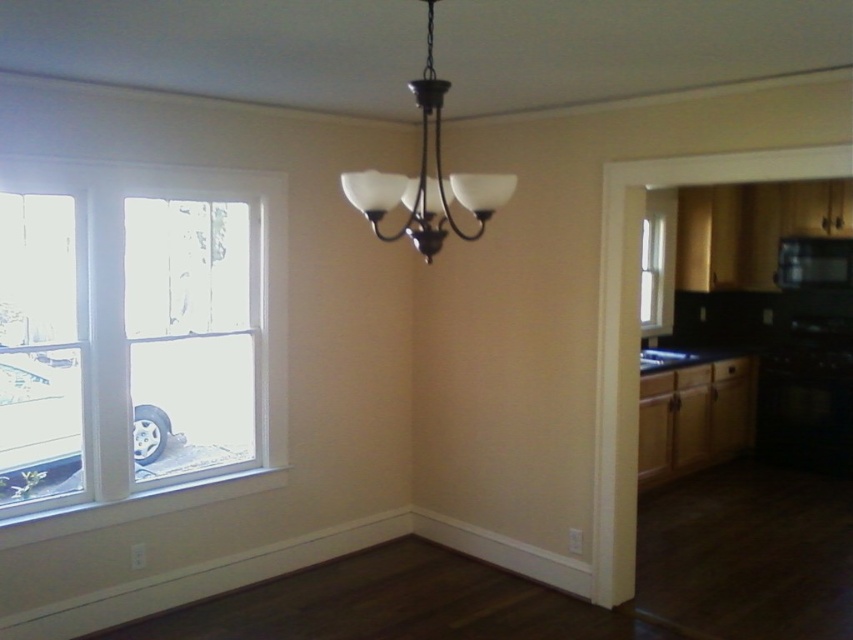
Question: Which of the following is the closest to the observer?

Choices:
 (A) (410, 220)
 (B) (653, 288)
 (C) (833, 260)
 (D) (207, 298)

Answer: (D)

Question: Can you confirm if matte black chandelier at upper center is smaller than black matte microwave at upper right?

Choices:
 (A) no
 (B) yes

Answer: (A)

Question: Can you confirm if matte black chandelier at upper center is positioned to the left of black matte microwave at upper right?

Choices:
 (A) yes
 (B) no

Answer: (A)

Question: Is white glass window at left smaller than matte black chandelier at upper center?

Choices:
 (A) yes
 (B) no

Answer: (B)

Question: Among these points, which one is nearest to the camera?

Choices:
 (A) (646, 288)
 (B) (467, 188)
 (C) (787, 257)

Answer: (B)

Question: Estimate the real-world distances between objects in this image. Which object is closer to the black matte microwave at upper right?

Choices:
 (A) clear glass window at right
 (B) matte black chandelier at upper center
 (C) white glass window at left

Answer: (A)